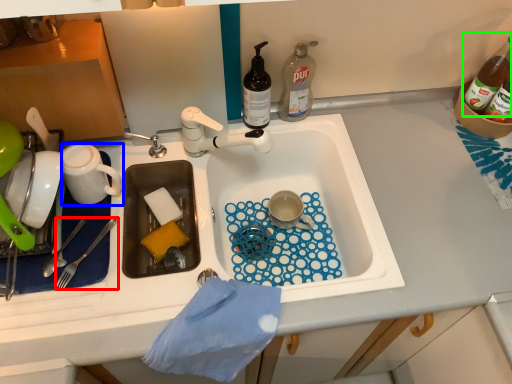
Question: Which object is the closest to the fork (highlighted by a red box)? Choose among these: coffee cup (highlighted by a blue box) or bottle (highlighted by a green box).

Choices:
 (A) coffee cup
 (B) bottle

Answer: (A)